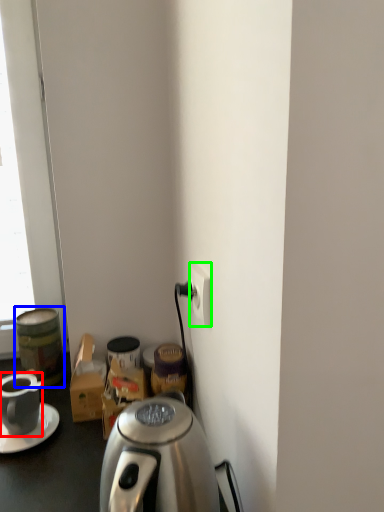
Question: Considering the real-world distances, which object is farthest from coffee cup (highlighted by a red box)? beverage (highlighted by a blue box) or power outlet (highlighted by a green box)?

Choices:
 (A) beverage
 (B) power outlet

Answer: (B)